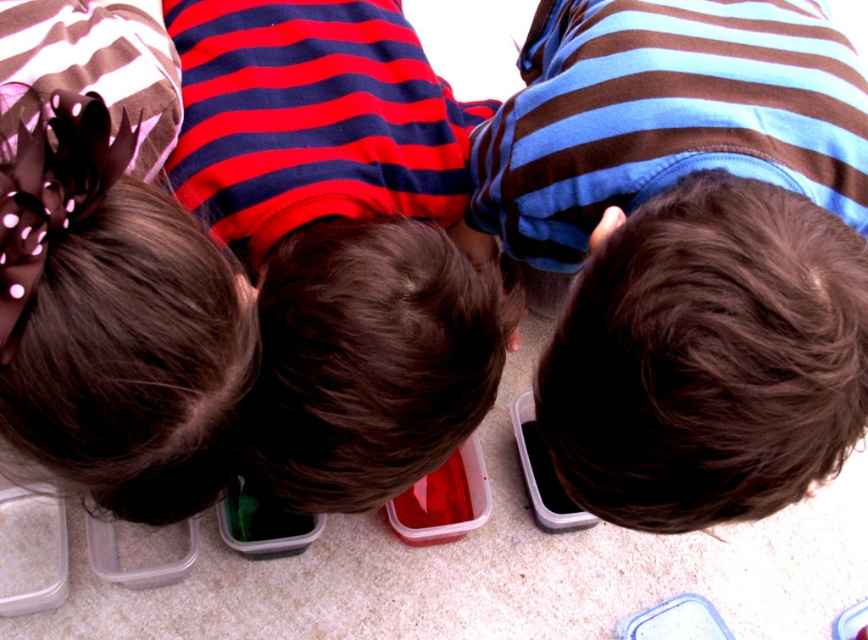
You are a photographer trying to capture a clear shot of the brown striped shirt at center and the red striped shirt at center. Since you can only focus on one shirt at a time, which shirt should you focus on first to ensure the other is in the background?

The brown striped shirt at center is located above the red striped shirt at center, so you should focus on the brown striped shirt at center first to keep the red striped shirt at center in the background.

You are observing three children around two points marked in the image. The first point is at coordinate (560, 106) and the second point is at (298, 128). From your perspective, which point is closer to you?

Point (560, 106) is in front of point (298, 128), so it is closer to you.

You are a photographer trying to capture a group photo of the children. Since you want to ensure everyone is visible, you need to arrange them so that the thinner child is not blocked by the thicker one. Given the brown striped shirt at center and the red striped shirt at center, which child should you place in front to avoid blocking?

The brown striped shirt at center is thinner than the red striped shirt at center, so you should place the brown striped shirt at center in front to avoid blocking the thicker child.